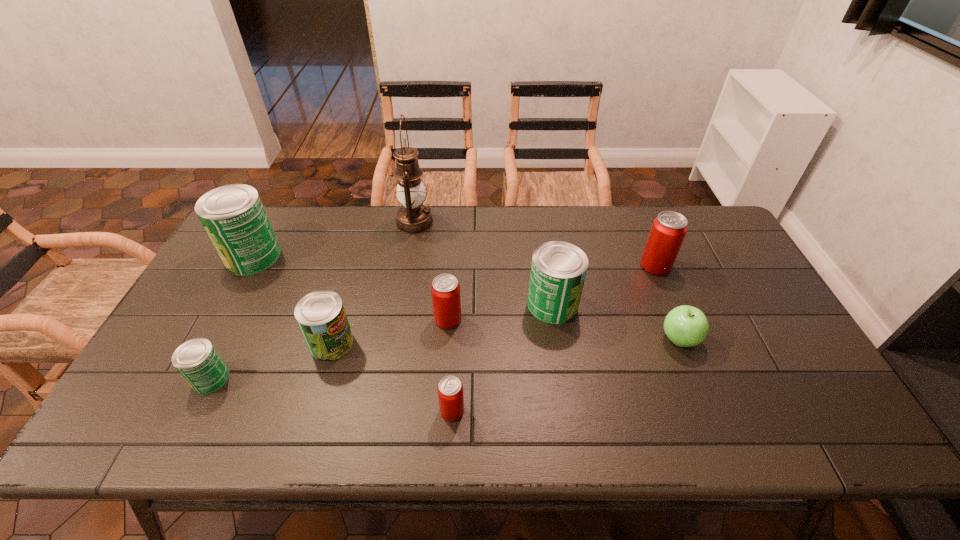
Where is `vacant area situated 0.150m on the front of the second biggest red can`? vacant area situated 0.150m on the front of the second biggest red can is located at coordinates (444, 378).

Locate an element on the screen. The height and width of the screenshot is (540, 960). free space located 0.160m on the front of the third green can from left to right is located at coordinates coord(309,420).

Where is `vacant space located 0.200m on the left of the green apple`? vacant space located 0.200m on the left of the green apple is located at coordinates (585, 339).

Image resolution: width=960 pixels, height=540 pixels. What are the coordinates of `free space located 0.260m on the left of the nearest can` in the screenshot? It's located at (328, 410).

Identify the location of blank space located 0.250m on the right of the second nearest can. (329, 379).

The width and height of the screenshot is (960, 540). Identify the location of oil lamp located at the far edge. (413, 217).

Where is `can located in the far edge section of the desktop`? can located in the far edge section of the desktop is located at coordinates (233, 216).

Where is `object at the near edge`? This screenshot has height=540, width=960. object at the near edge is located at coordinates (450, 390).

Identify the location of object present at the far left corner. (233, 216).

Identify the location of free space at the far edge of the desktop. The width and height of the screenshot is (960, 540). (305, 245).